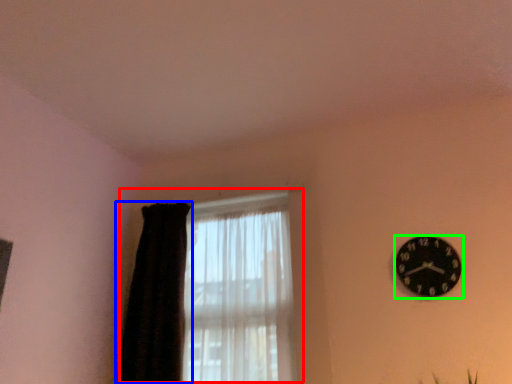
Question: Which object is positioned closest to window (highlighted by a red box)? Select from curtain (highlighted by a blue box) and wall clock (highlighted by a green box).

Choices:
 (A) curtain
 (B) wall clock

Answer: (A)